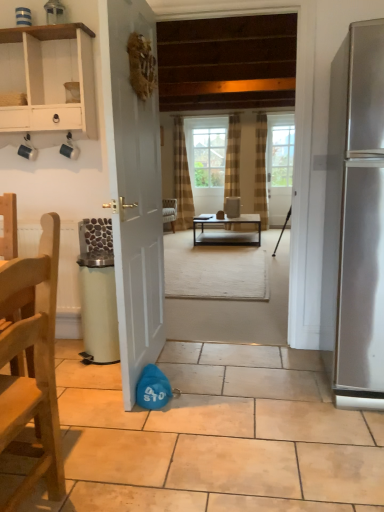
Question: Does clear glass window screen at center have a greater height compared to wooden chair at left?

Choices:
 (A) yes
 (B) no

Answer: (A)

Question: Is wooden chair at left located within clear glass window screen at center?

Choices:
 (A) yes
 (B) no

Answer: (B)

Question: Would you consider clear glass window screen at center to be distant from wooden chair at left?

Choices:
 (A) no
 (B) yes

Answer: (B)

Question: Does clear glass window screen at center have a lesser width compared to wooden chair at left?

Choices:
 (A) yes
 (B) no

Answer: (A)

Question: Can you confirm if clear glass window screen at center is bigger than wooden chair at left?

Choices:
 (A) yes
 (B) no

Answer: (B)

Question: Can you confirm if clear glass window screen at center is smaller than wooden chair at left?

Choices:
 (A) yes
 (B) no

Answer: (A)

Question: Is clear glass window screen at center completely or partially inside brown textured curtain at center?

Choices:
 (A) no
 (B) yes

Answer: (A)

Question: From the image's perspective, is brown textured curtain at center beneath clear glass window screen at center?

Choices:
 (A) yes
 (B) no

Answer: (A)

Question: Is brown textured curtain at center completely or partially outside of clear glass window screen at center?

Choices:
 (A) no
 (B) yes

Answer: (B)

Question: Is the position of brown textured curtain at center less distant than that of clear glass window screen at center?

Choices:
 (A) no
 (B) yes

Answer: (B)

Question: From the image's perspective, is brown textured curtain at center above clear glass window screen at center?

Choices:
 (A) yes
 (B) no

Answer: (B)

Question: Considering the relative sizes of brown textured curtain at center and clear glass window screen at center in the image provided, is brown textured curtain at center wider than clear glass window screen at center?

Choices:
 (A) yes
 (B) no

Answer: (A)

Question: Is brown textured curtain at center smaller than white matte door at center, which ranks as the 1th door in left-to-right order?

Choices:
 (A) no
 (B) yes

Answer: (B)